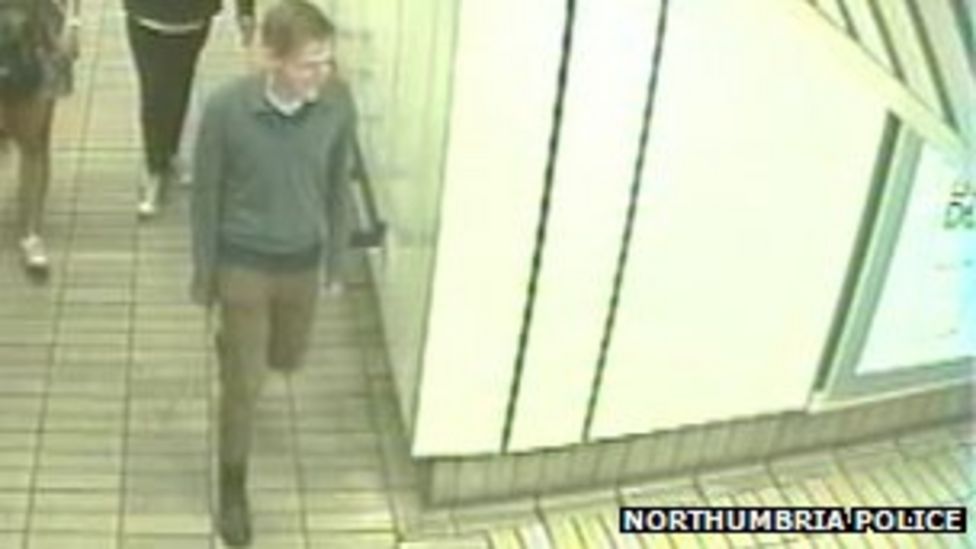
You are a GUI agent. You are given a task and a screenshot of the screen. Output one action in this format:
    pyautogui.click(x=<x>, y=<y>)
    Task: Click on the floor
    The width and height of the screenshot is (976, 549).
    Given the screenshot: What is the action you would take?
    pyautogui.click(x=74, y=441), pyautogui.click(x=556, y=528)